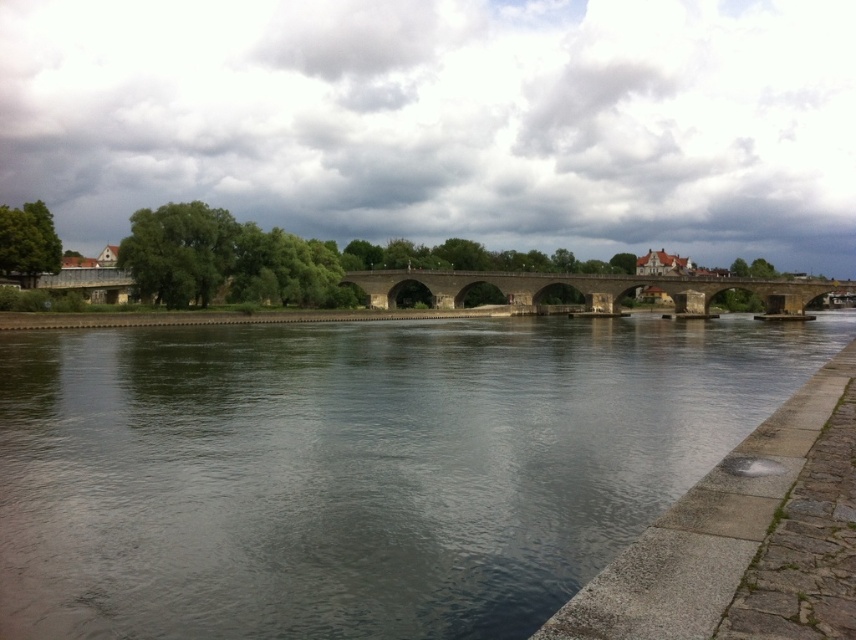
Question: Is dark gray water at center below stone arch bridge at center?

Choices:
 (A) yes
 (B) no

Answer: (A)

Question: Is dark gray water at center smaller than stone arch bridge at center?

Choices:
 (A) no
 (B) yes

Answer: (A)

Question: Which point appears farthest from the camera in this image?

Choices:
 (A) (779, 285)
 (B) (233, 472)

Answer: (A)

Question: Does dark gray water at center appear on the right side of stone arch bridge at center?

Choices:
 (A) no
 (B) yes

Answer: (A)

Question: Which of the following is the closest to the observer?

Choices:
 (A) stone arch bridge at center
 (B) dark gray water at center

Answer: (B)